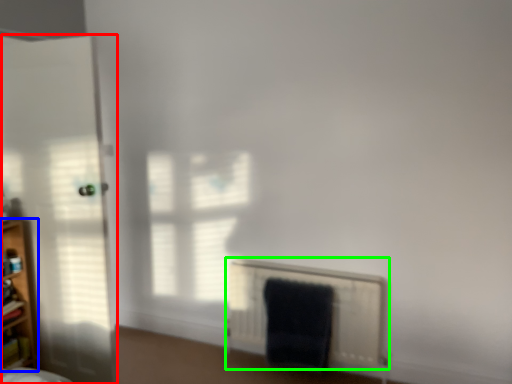
Question: Estimate the real-world distances between objects in this image. Which object is farther from door (highlighted by a red box), shelf (highlighted by a blue box) or radiator (highlighted by a green box)?

Choices:
 (A) shelf
 (B) radiator

Answer: (B)